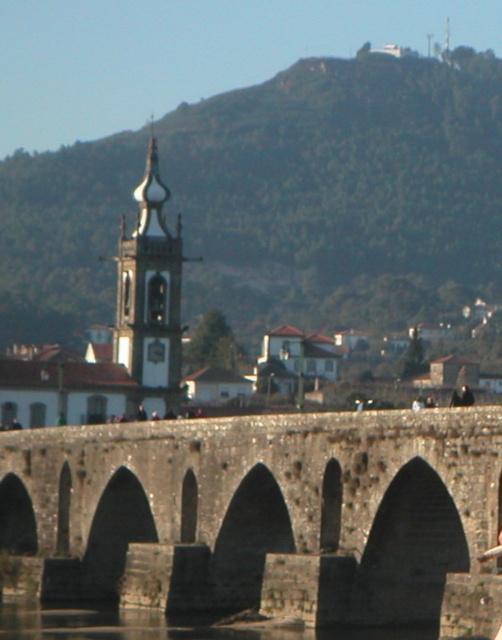
You are a tourist standing at the base of the hill. You want to take a photo of the stone arch bridge at center from a position that is exactly 50 meters away from it. Is this possible given your current location?

The stone arch bridge at center is currently 66.92 meters away from you. Since you need to be exactly 50 meters away, you need to move closer by 16.92 meters towards the bridge to achieve the desired distance.

You are an architect analyzing the structural integrity of the stone arch bridge at center and the clear water at bridge center. Which of these two elements occupies a greater physical space in the image?

The stone arch bridge at center is larger in size than clear water at bridge center, so the stone arch bridge at center occupies a greater physical space in the image.

Consider the image. You are standing on the stone arch bridge at center and want to cross to the other side. Can you see the clear water at bridge center from where you are standing?

Yes, because the stone arch bridge at center is located above the clear water at bridge center, so you can see the water below as you cross.